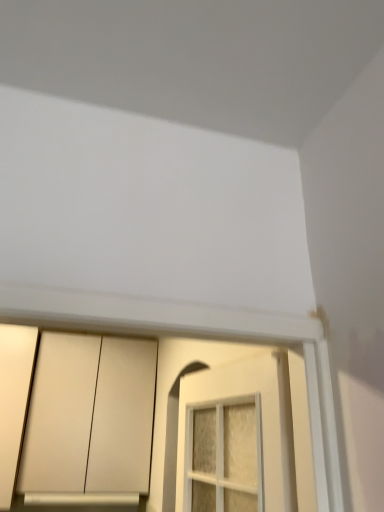
Describe the element at coordinates (14, 400) in the screenshot. The width and height of the screenshot is (384, 512). I see `matte white door at lower left` at that location.

The image size is (384, 512). I want to click on matte white cabinet at lower left, so click(x=75, y=416).

Relative to matte white cabinet at lower left, is matte white door at lower left in front or behind?

Visually, matte white door at lower left is located in front of matte white cabinet at lower left.

Looking at the image, does matte white door at lower left seem bigger or smaller compared to matte white cabinet at lower left?

In the image, matte white door at lower left appears to be smaller than matte white cabinet at lower left.

The width and height of the screenshot is (384, 512). In the image, there is a matte white door at lower left. Identify the location of cabinetry below it (from the image's perspective). coord(75,416).

Between matte white door at lower left and matte white cabinet at lower left, which one has smaller width?

matte white door at lower left is thinner.

Can you confirm if matte white cabinet at lower left is positioned to the right of silver metallic window sill at lower center?

Yes.

Does matte white cabinet at lower left have a smaller size compared to silver metallic window sill at lower center?

Actually, matte white cabinet at lower left might be larger than silver metallic window sill at lower center.

Is matte white cabinet at lower left further to the viewer compared to silver metallic window sill at lower center?

That is False.

Is matte white cabinet at lower left far from silver metallic window sill at lower center?

No.

Between silver metallic window sill at lower center and matte white cabinet at lower left, which one appears on the left side from the viewer's perspective?

From the viewer's perspective, silver metallic window sill at lower center appears more on the left side.

Who is taller, silver metallic window sill at lower center or matte white cabinet at lower left?

Standing taller between the two is matte white cabinet at lower left.

Can you confirm if silver metallic window sill at lower center is thinner than matte white cabinet at lower left?

Correct, the width of silver metallic window sill at lower center is less than that of matte white cabinet at lower left.

Is silver metallic window sill at lower center located outside matte white cabinet at lower left?

Actually, silver metallic window sill at lower center is at least partially inside matte white cabinet at lower left.

Considering the sizes of silver metallic window sill at lower center and matte white door at lower left in the image, is silver metallic window sill at lower center taller or shorter than matte white door at lower left?

silver metallic window sill at lower center is shorter than matte white door at lower left.

Can you confirm if silver metallic window sill at lower center is positioned to the right of matte white door at lower left?

Yes.

From the image's perspective, would you say silver metallic window sill at lower center is positioned over matte white door at lower left?

No.

Looking at the image, does matte white door at lower left seem bigger or smaller compared to silver metallic window sill at lower center?

Considering their sizes, matte white door at lower left takes up more space than silver metallic window sill at lower center.

Is matte white door at lower left oriented towards silver metallic window sill at lower center?

No, matte white door at lower left does not turn towards silver metallic window sill at lower center.

Is matte white door at lower left at the left side of silver metallic window sill at lower center?

Indeed, matte white door at lower left is positioned on the left side of silver metallic window sill at lower center.

At what (x,y) coordinates should I click in order to perform the action: click on door that appears on the left of silver metallic window sill at lower center. Please return your answer as a coordinate pair (x, y). This screenshot has height=512, width=384. Looking at the image, I should click on (14, 400).

Which is closer to the camera, (98, 409) or (8, 410)?

The point (8, 410) is closer.

Based on the photo, which object is positioned more to the left, matte white cabinet at lower left or matte white door at lower left?

Positioned to the left is matte white door at lower left.

From a real-world perspective, is matte white cabinet at lower left above or below matte white door at lower left?

matte white cabinet at lower left is situated higher than matte white door at lower left in the real world.

This screenshot has width=384, height=512. In order to click on door in front of the matte white cabinet at lower left in this screenshot , I will do `click(14, 400)`.

The width and height of the screenshot is (384, 512). What are the coordinates of `cabinetry above the silver metallic window sill at lower center (from the image's perspective)` in the screenshot? It's located at (75, 416).

Consider the image. Based on their spatial positions, is matte white door at lower left or matte white cabinet at lower left further from silver metallic window sill at lower center?

matte white door at lower left lies further to silver metallic window sill at lower center than the other object.

Which object lies further to the anchor point matte white door at lower left, matte white cabinet at lower left or silver metallic window sill at lower center?

silver metallic window sill at lower center.

Looking at the image, which one is located further to matte white cabinet at lower left, matte white door at lower left or silver metallic window sill at lower center?

The object further to matte white cabinet at lower left is silver metallic window sill at lower center.

When comparing their distances from matte white cabinet at lower left, does silver metallic window sill at lower center or matte white door at lower left seem closer?

The object closer to matte white cabinet at lower left is matte white door at lower left.

Which object lies nearer to the anchor point silver metallic window sill at lower center, matte white cabinet at lower left or matte white door at lower left?

matte white cabinet at lower left is positioned closer to the anchor silver metallic window sill at lower center.

Based on their spatial positions, is silver metallic window sill at lower center or matte white cabinet at lower left further from matte white door at lower left?

silver metallic window sill at lower center is further to matte white door at lower left.

Find the location of a particular element. cabinetry between matte white door at lower left and silver metallic window sill at lower center vertically is located at coordinates (75, 416).